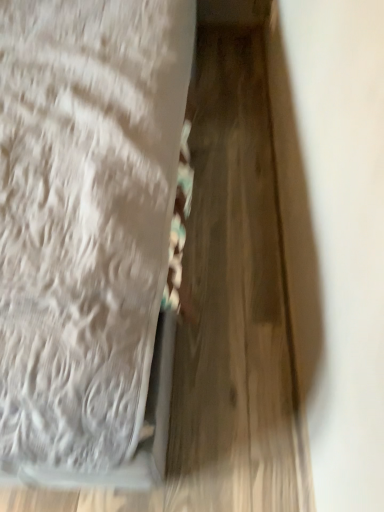
What do you see at coordinates (88, 234) in the screenshot? I see `white textured mattress at upper left` at bounding box center [88, 234].

I want to click on white textured mattress at upper left, so click(88, 234).

Locate an element on the screen. The height and width of the screenshot is (512, 384). white textured mattress at upper left is located at coordinates (88, 234).